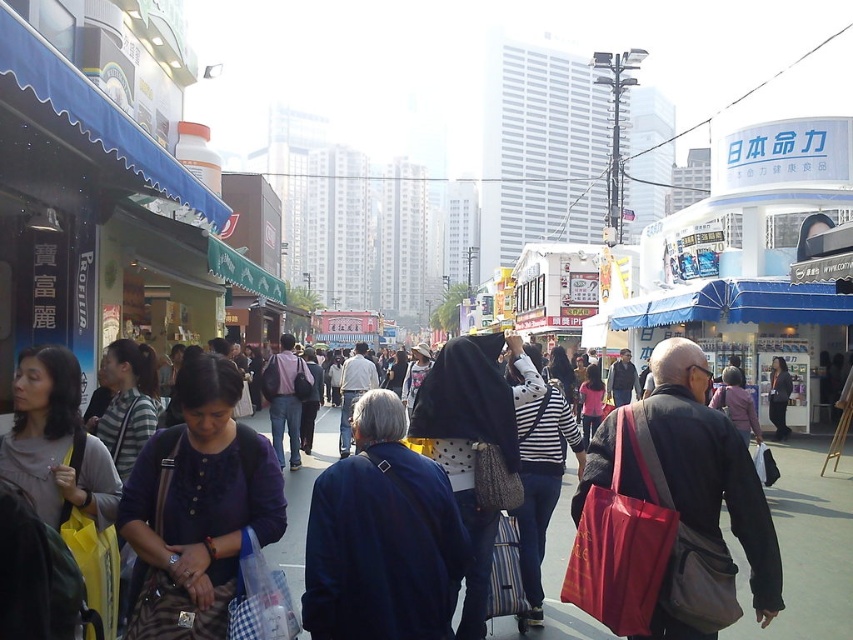
You are a delivery person with a cart that requires a 10 meter path to maneuver. You need to navigate through the busy street while avoiding pedestrians. Can you safely pass through the space between the matte blue shirt at center and the red fabric bag at center?

The distance between the matte blue shirt at center and the red fabric bag at center is 9.04 meters, which is slightly shorter than the required 10 meters needed for the cart to maneuver. Therefore, it would not be safe to pass through this space as there isn

You are a delivery person who needs to place a small package in either the red fabric bag at center or the dark gray sweater at center. Based on their sizes, which one can you choose?

The red fabric bag at center is shorter than the dark gray sweater at center, so you can choose the dark gray sweater at center since it is taller and may have more space to accommodate the package.

You are a photographer standing on the sidewalk in this busy urban scene. You notice a matte blue shirt at center and a red fabric bag at center. Which object is positioned higher from the ground?

The matte blue shirt at center is above the red fabric bag at center, so it is positioned higher from the ground.